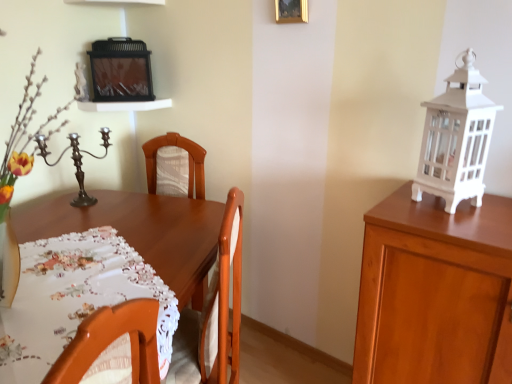
Question: Should I look upward or downward to see white printed tablecloth at center?

Choices:
 (A) down
 (B) up

Answer: (A)

Question: Is white painted glass lantern at right touching white printed tablecloth at center?

Choices:
 (A) yes
 (B) no

Answer: (B)

Question: From a real-world perspective, is white painted glass lantern at right on white printed tablecloth at center?

Choices:
 (A) yes
 (B) no

Answer: (A)

Question: Is white painted glass lantern at right further to camera compared to white printed tablecloth at center?

Choices:
 (A) no
 (B) yes

Answer: (B)

Question: Is white painted glass lantern at right thinner than white printed tablecloth at center?

Choices:
 (A) no
 (B) yes

Answer: (B)

Question: Is white printed tablecloth at center located within white painted glass lantern at right?

Choices:
 (A) yes
 (B) no

Answer: (B)

Question: From the image's perspective, is white painted glass lantern at right located beneath white printed tablecloth at center?

Choices:
 (A) yes
 (B) no

Answer: (B)

Question: Is polished bronze candle holder at left aimed at gold metallic picture frame at upper center?

Choices:
 (A) no
 (B) yes

Answer: (A)

Question: Can you confirm if polished bronze candle holder at left is wider than gold metallic picture frame at upper center?

Choices:
 (A) no
 (B) yes

Answer: (B)

Question: Considering the relative positions of polished bronze candle holder at left and gold metallic picture frame at upper center in the image provided, is polished bronze candle holder at left behind gold metallic picture frame at upper center?

Choices:
 (A) no
 (B) yes

Answer: (B)

Question: From the image's perspective, does polished bronze candle holder at left appear higher than gold metallic picture frame at upper center?

Choices:
 (A) yes
 (B) no

Answer: (B)

Question: From a real-world perspective, is polished bronze candle holder at left physically above gold metallic picture frame at upper center?

Choices:
 (A) no
 (B) yes

Answer: (A)

Question: Are polished bronze candle holder at left and gold metallic picture frame at upper center far apart?

Choices:
 (A) no
 (B) yes

Answer: (B)

Question: From the image's perspective, is white wood cabinet at right under polished bronze candle holder at left?

Choices:
 (A) yes
 (B) no

Answer: (A)